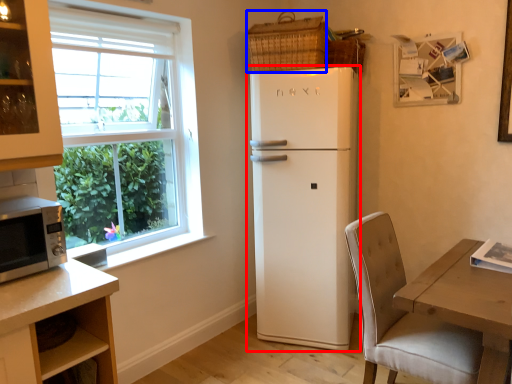
Question: Among these objects, which one is nearest to the camera, refrigerator (highlighted by a red box) or basket (highlighted by a blue box)?

Choices:
 (A) refrigerator
 (B) basket

Answer: (A)